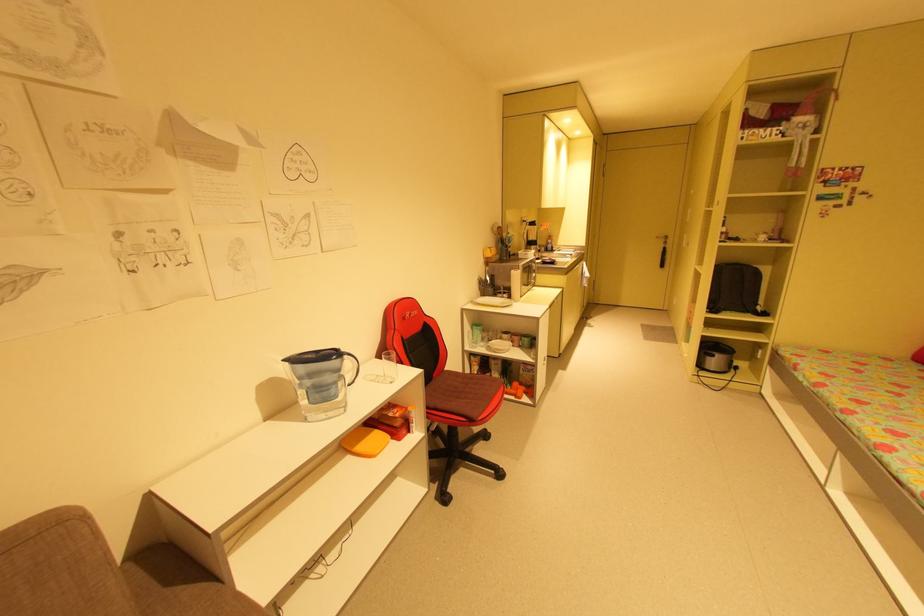
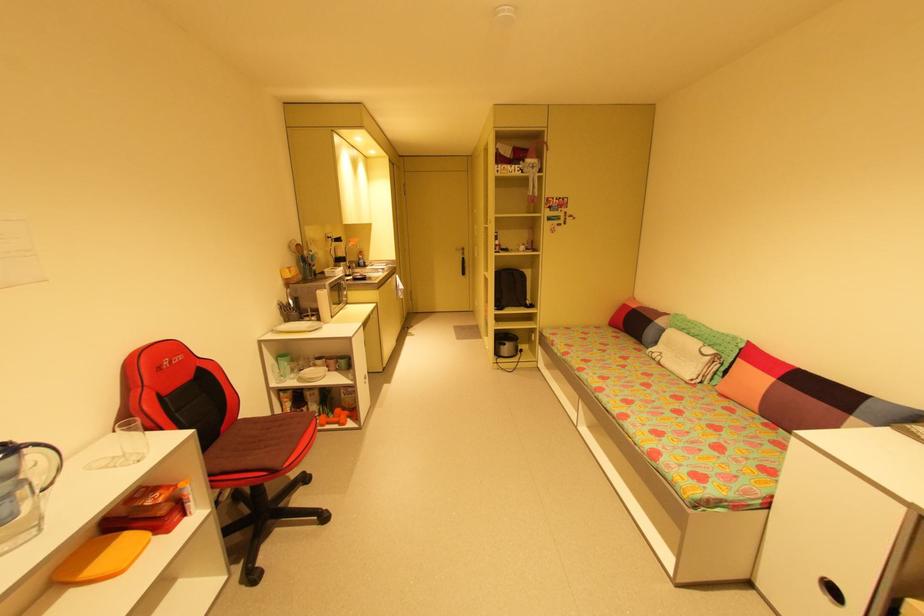
In the second image, find the point that corresponds to (x=393, y=379) in the first image.

(139, 459)